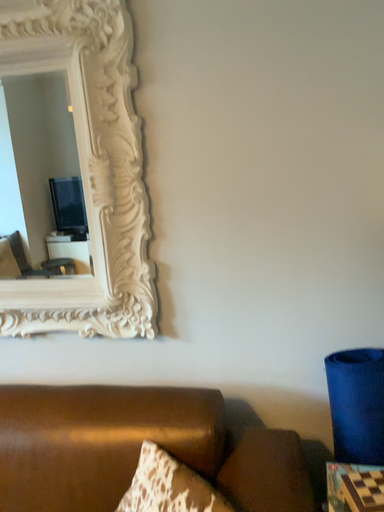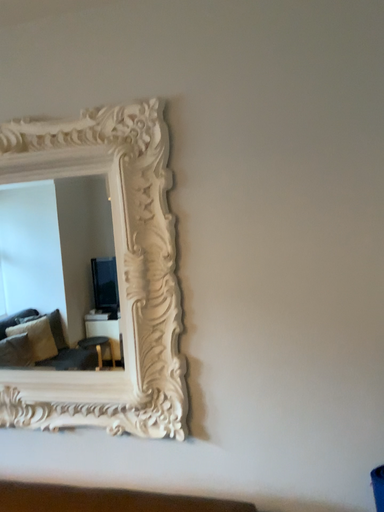
Question: Which way did the camera rotate in the video?

Choices:
 (A) rotated downward
 (B) rotated upward

Answer: (B)